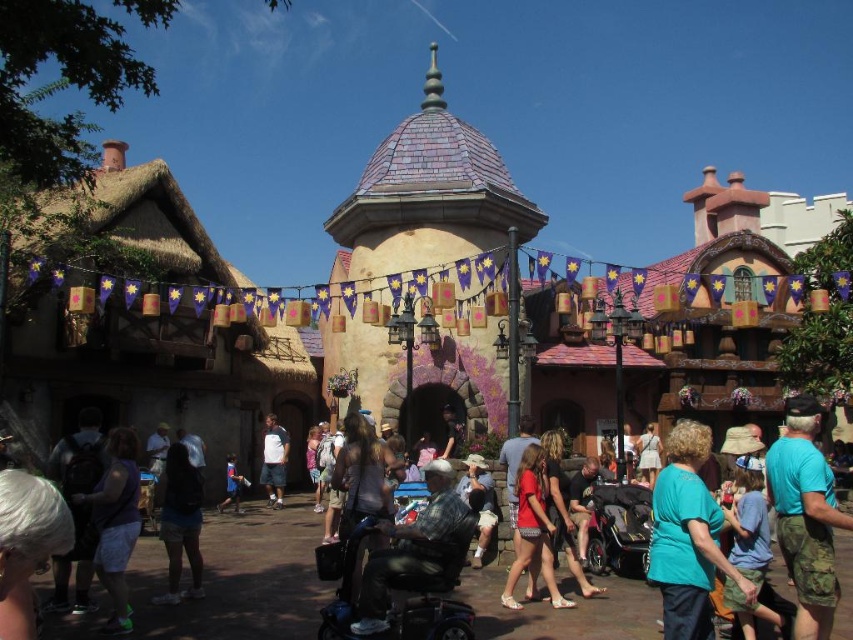
You are a visitor at this themed area and see two people wearing a teal fabric shirt at center and a matte red shirt at center. Which person is standing to the right of the other?

The teal fabric shirt at center is to the right of the matte red shirt at center, so the person wearing the teal fabric shirt at center is standing to the right of the person in the matte red shirt at center.

You are a photographer trying to capture both the teal fabric shirt at center and the matte red shirt at center in a single frame. Which person should you position closer to the camera to ensure both are fully visible?

Since the teal fabric shirt at center is taller than the matte red shirt at center, you should position the person wearing the teal fabric shirt at center closer to the camera to ensure both are fully visible in the frame.

You are a photographer at the theme park and want to capture both the teal fabric shirt at center and the black plastic baby carriage at lower center in a single photo. Which object should you focus on first to ensure both are in frame?

The teal fabric shirt at center is larger in size than the black plastic baby carriage at lower center, so you should focus on the teal fabric shirt at center first to ensure both are in frame.